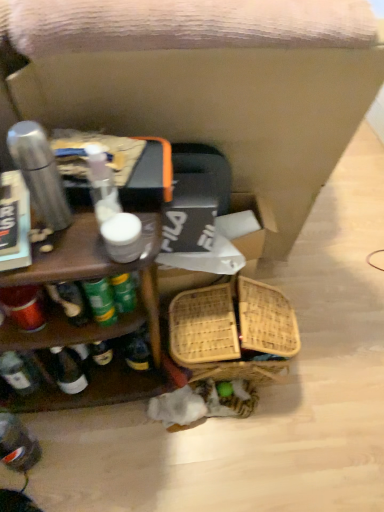
Question: From the image's perspective, would you say woven bamboo basket at lower center is shown under wooden shelf at left?

Choices:
 (A) yes
 (B) no

Answer: (A)

Question: From a real-world perspective, is woven bamboo basket at lower center positioned over wooden shelf at left based on gravity?

Choices:
 (A) no
 (B) yes

Answer: (A)

Question: Can you confirm if woven bamboo basket at lower center is shorter than wooden shelf at left?

Choices:
 (A) yes
 (B) no

Answer: (A)

Question: Is woven bamboo basket at lower center positioned with its back to wooden shelf at left?

Choices:
 (A) yes
 (B) no

Answer: (B)

Question: Is woven bamboo basket at lower center facing towards wooden shelf at left?

Choices:
 (A) yes
 (B) no

Answer: (B)

Question: Does woven bamboo basket at lower center appear on the left side of wooden shelf at left?

Choices:
 (A) no
 (B) yes

Answer: (A)

Question: Is there a large distance between wooden shelf at left and woven cardboard box at center?

Choices:
 (A) no
 (B) yes

Answer: (A)

Question: Does wooden shelf at left have a greater height compared to woven cardboard box at center?

Choices:
 (A) no
 (B) yes

Answer: (B)

Question: Is woven cardboard box at center located within wooden shelf at left?

Choices:
 (A) no
 (B) yes

Answer: (A)

Question: Is wooden shelf at left bigger than woven cardboard box at center?

Choices:
 (A) no
 (B) yes

Answer: (B)

Question: Does wooden shelf at left have a lesser width compared to woven cardboard box at center?

Choices:
 (A) no
 (B) yes

Answer: (A)

Question: Is wooden shelf at left facing away from woven cardboard box at center?

Choices:
 (A) yes
 (B) no

Answer: (B)

Question: Considering the relative sizes of wooden shelf at left and wooden swivel chair at center in the image provided, is wooden shelf at left taller than wooden swivel chair at center?

Choices:
 (A) no
 (B) yes

Answer: (A)